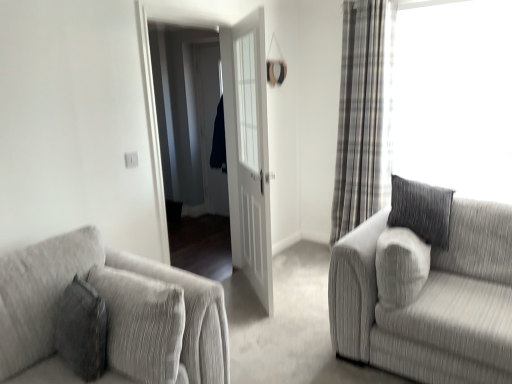
Question: Considering the positions of point (361, 304) and point (209, 362), is point (361, 304) closer or farther from the camera than point (209, 362)?

Choices:
 (A) farther
 (B) closer

Answer: (A)

Question: In terms of height, does textured gray couch at right, placed as the 2th studio couch when sorted from left to right, look taller or shorter compared to textured gray couch at lower left, the 2th studio couch in the right-to-left sequence?

Choices:
 (A) tall
 (B) short

Answer: (B)

Question: Which object is positioned closest to the white matte door at center?

Choices:
 (A) white glossy door at center
 (B) plaid fabric curtain at right
 (C) textured gray couch at lower left, the 2th studio couch in the right-to-left sequence
 (D) textured gray couch at right, the 1th studio couch viewed from the right

Answer: (A)

Question: Estimate the real-world distances between objects in this image. Which object is closer to the textured gray couch at right, the 1th studio couch viewed from the right?

Choices:
 (A) white matte door at center
 (B) plaid fabric curtain at right
 (C) white glossy door at center
 (D) textured gray couch at lower left, the 2th studio couch in the right-to-left sequence

Answer: (A)